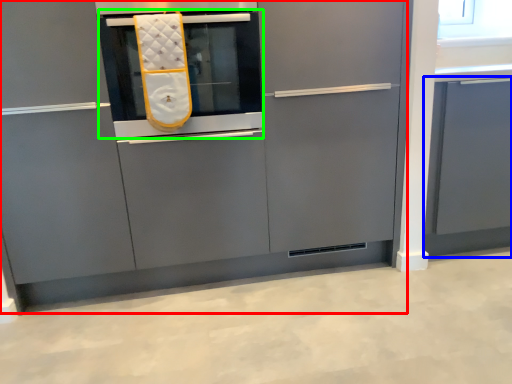
Question: Which is farther away from cabinetry (highlighted by a red box)? cabinetry (highlighted by a blue box) or oven (highlighted by a green box)?

Choices:
 (A) cabinetry
 (B) oven

Answer: (A)